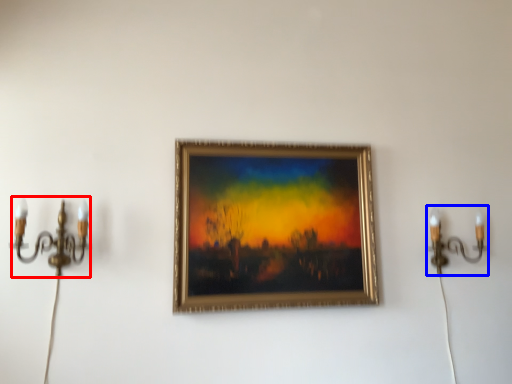
Question: Which object is closer to the camera taking this photo, candle holder (highlighted by a red box) or candle holder (highlighted by a blue box)?

Choices:
 (A) candle holder
 (B) candle holder

Answer: (A)